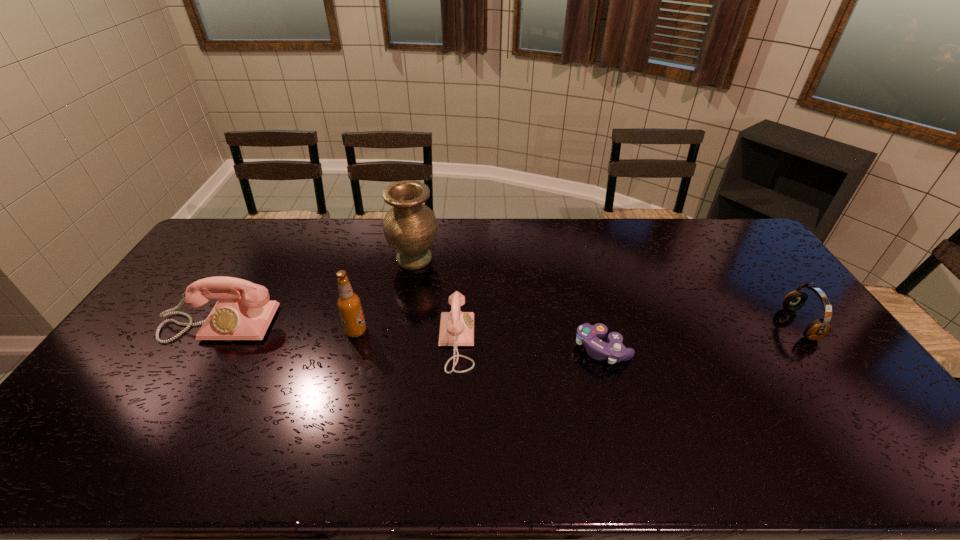
Where is `vacant area that satisfies the following two spatial constraints: 1. on the front side of the vase; 2. on the right side of the control`? vacant area that satisfies the following two spatial constraints: 1. on the front side of the vase; 2. on the right side of the control is located at coordinates click(398, 348).

Locate an element on the screen. This screenshot has width=960, height=540. vacant area in the image that satisfies the following two spatial constraints: 1. on the front label of the beer bottle; 2. on the left side of the fifth object from left to right is located at coordinates (351, 348).